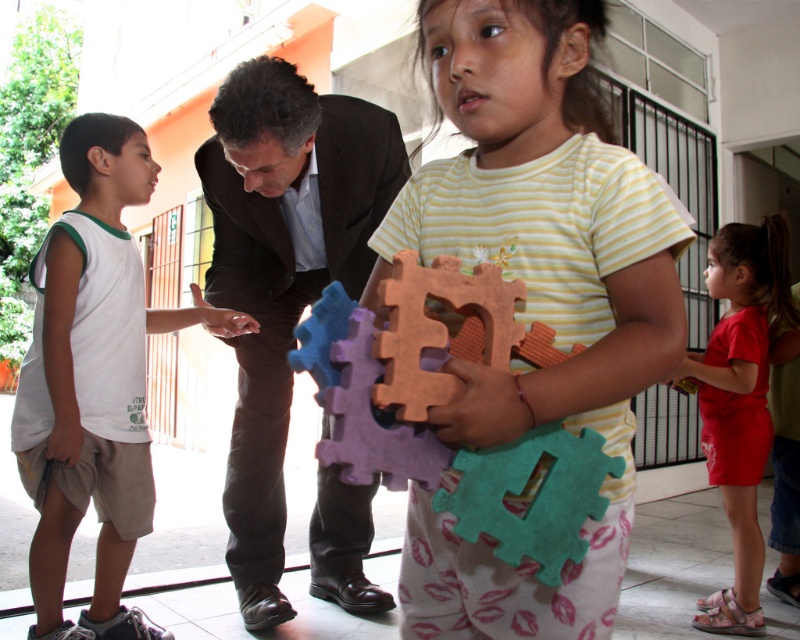
Question: Can you confirm if matte plastic puzzle pieces at center is smaller than matte red shorts at lower right?

Choices:
 (A) yes
 (B) no

Answer: (A)

Question: Which object is the farthest from the soft felt puzzle at center?

Choices:
 (A) white cotton shirt at left
 (B) matte red shorts at lower right

Answer: (B)

Question: Does matte plastic puzzle pieces at center come behind white cotton shirt at left?

Choices:
 (A) no
 (B) yes

Answer: (A)

Question: Which object appears closest to the camera in this image?

Choices:
 (A) soft felt puzzle at center
 (B) matte plastic puzzle pieces at center

Answer: (A)

Question: Which of the following is the closest to the observer?

Choices:
 (A) (380, 372)
 (B) (722, 380)

Answer: (A)

Question: Does white cotton shirt at left appear on the left side of matte red shorts at lower right?

Choices:
 (A) no
 (B) yes

Answer: (B)